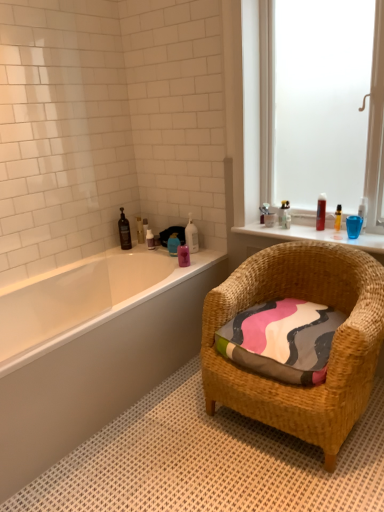
Find the location of a particular element. The width and height of the screenshot is (384, 512). vacant area that lies in front of clear plastic bottle at upper right, which is the eighth toiletry in left-to-right order is located at coordinates (278, 229).